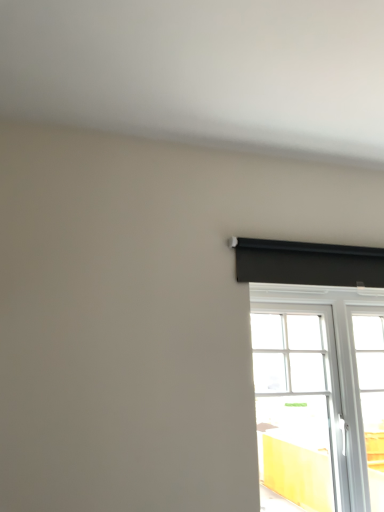
Question: Which is correct: black matte curtain at upper right is inside white glass window at right, or outside of it?

Choices:
 (A) inside
 (B) outside

Answer: (B)

Question: Is black matte curtain at upper right to the left or to the right of white glass window at right in the image?

Choices:
 (A) right
 (B) left

Answer: (B)

Question: From the image's perspective, is black matte curtain at upper right above or below white glass window at right?

Choices:
 (A) above
 (B) below

Answer: (A)

Question: Considering the positions of point (286, 455) and point (377, 247), is point (286, 455) closer or farther from the camera than point (377, 247)?

Choices:
 (A) farther
 (B) closer

Answer: (B)

Question: Is white glass window at right to the left or to the right of black matte curtain at upper right in the image?

Choices:
 (A) right
 (B) left

Answer: (A)

Question: Is white glass window at right in front of or behind black matte curtain at upper right in the image?

Choices:
 (A) front
 (B) behind

Answer: (A)

Question: From the image's perspective, is white glass window at right located above or below black matte curtain at upper right?

Choices:
 (A) below
 (B) above

Answer: (A)